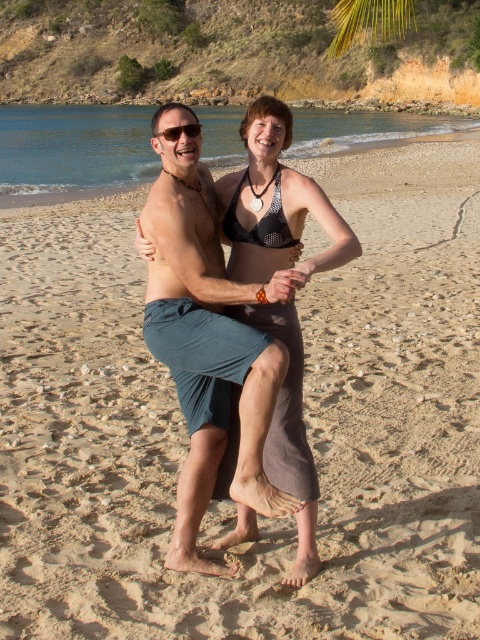
Is matte gray sarong at center above green leafy palm tree at upper right?

Actually, matte gray sarong at center is below green leafy palm tree at upper right.

Between matte gray sarong at center and green leafy palm tree at upper right, which one is positioned higher?

Positioned higher is green leafy palm tree at upper right.

What do you see at coordinates (277, 198) in the screenshot?
I see `matte gray sarong at center` at bounding box center [277, 198].

Identify the location of matte gray sarong at center. (277, 198).

Can you confirm if green leafy palm tree at upper right is taller than matte black sunglasses at upper center?

Correct, green leafy palm tree at upper right is much taller as matte black sunglasses at upper center.

This screenshot has height=640, width=480. Describe the element at coordinates (370, 20) in the screenshot. I see `green leafy palm tree at upper right` at that location.

This screenshot has width=480, height=640. What do you see at coordinates (370, 20) in the screenshot? I see `green leafy palm tree at upper right` at bounding box center [370, 20].

You are a GUI agent. You are given a task and a screenshot of the screen. Output one action in this format:
    pyautogui.click(x=<x>, y=<y>)
    Task: Click on the green leafy palm tree at upper right
    This screenshot has width=480, height=640.
    Given the screenshot: What is the action you would take?
    pyautogui.click(x=370, y=20)

Is matte gray sarong at center closer to camera compared to matte black sunglasses at upper center?

Yes, matte gray sarong at center is closer to the viewer.

Can you confirm if matte gray sarong at center is taller than matte black sunglasses at upper center?

No, matte gray sarong at center is not taller than matte black sunglasses at upper center.

What are the coordinates of `matte gray sarong at center` in the screenshot? It's located at (277, 198).